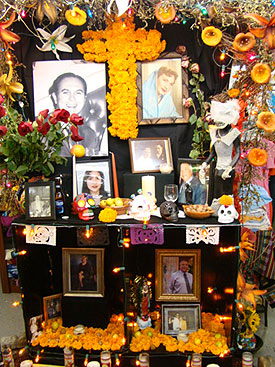
At what (x,y) coordinates should I click in order to perform the action: click on orange flowe. Please return your answer as a coordinate pair (x, y). Looking at the image, I should click on (147, 342).